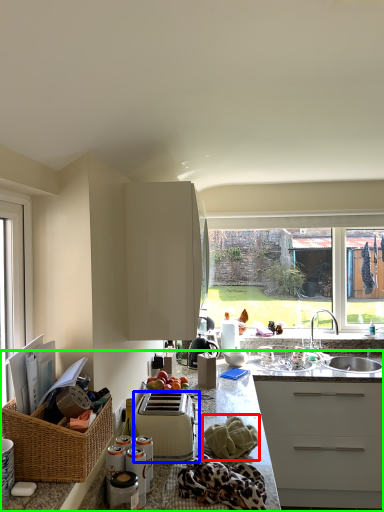
Question: Which is farther away from material (highlighted by a red box)? toaster (highlighted by a blue box) or countertop (highlighted by a green box)?

Choices:
 (A) toaster
 (B) countertop

Answer: (B)